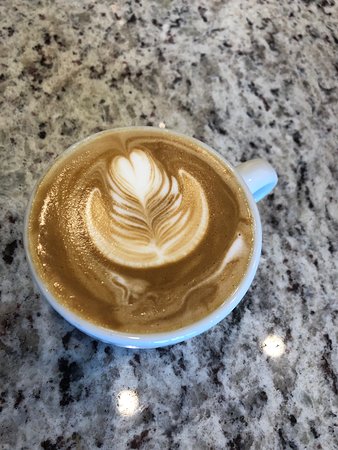
Identify the location of coffee mug. (146, 337), (199, 329), (228, 300).